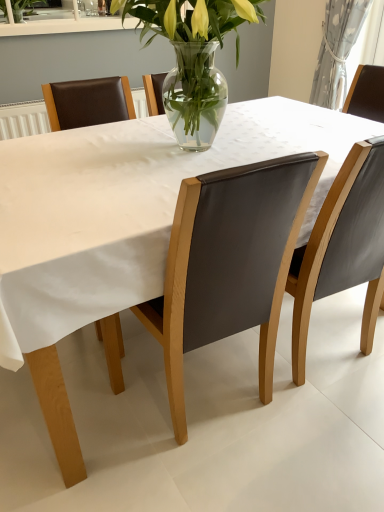
Identify the location of vacant area that is in front of matte gray chair at right, placed as the second chair when sorted from left to right. (331, 430).